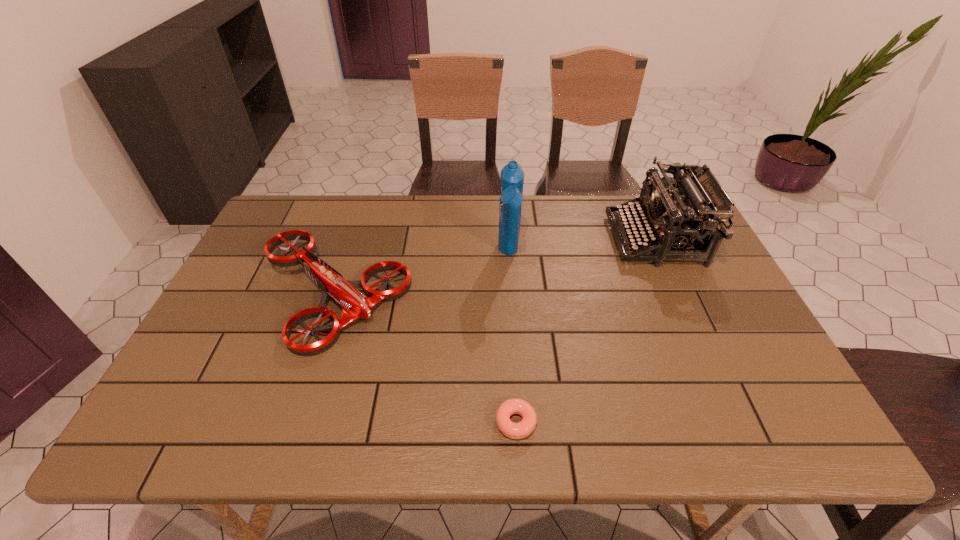
Where is `the tallest object`? The width and height of the screenshot is (960, 540). the tallest object is located at coordinates tap(512, 176).

Where is `the rightmost object`? The width and height of the screenshot is (960, 540). the rightmost object is located at coordinates (678, 222).

I want to click on typewriter, so click(678, 222).

Find the location of a particular element. the third tallest object is located at coordinates (355, 305).

This screenshot has width=960, height=540. I want to click on the leftmost object, so click(x=355, y=305).

This screenshot has width=960, height=540. Find the location of `the shortest object`. the shortest object is located at coordinates (525, 427).

The width and height of the screenshot is (960, 540). I want to click on the nearest object, so click(525, 427).

At what (x,y) coordinates should I click in order to perform the action: click on free space located 0.200m on the left of the shampoo. Please return your answer as a coordinate pair (x, y). Looking at the image, I should click on (431, 254).

Locate an element on the screen. blank area located on the typing side of the typewriter is located at coordinates (495, 239).

What are the coordinates of `vacant area situated on the typing side of the typewriter` in the screenshot? It's located at point(498,239).